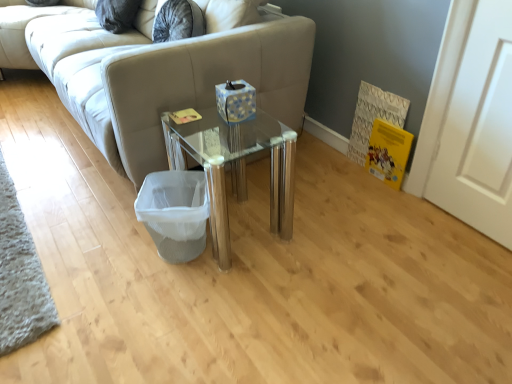
This screenshot has width=512, height=384. Describe the element at coordinates (175, 213) in the screenshot. I see `white mesh laundry basket at lower center` at that location.

Describe the element at coordinates (234, 167) in the screenshot. Image resolution: width=512 pixels, height=384 pixels. I see `transparent glass table at center` at that location.

At what (x,y) coordinates should I click in order to perform the action: click on beige fabric studio couch at center. Please return your answer as a coordinate pair (x, y). This screenshot has width=512, height=384. Looking at the image, I should click on coord(157,69).

This screenshot has height=384, width=512. Identify the location of white mesh laundry basket at lower center. (175, 213).

Consider the image. From the image's perspective, is beige fabric studio couch at center located above or below white mesh laundry basket at lower center?

Clearly, from the image's perspective, beige fabric studio couch at center is above white mesh laundry basket at lower center.

The image size is (512, 384). Find the location of `laundry basket below the beige fabric studio couch at center (from the image's perspective)`. laundry basket below the beige fabric studio couch at center (from the image's perspective) is located at coordinates 175,213.

Does point (77, 13) come farther from viewer compared to point (154, 209)?

Yes.

Who is taller, beige fabric studio couch at center or white mesh laundry basket at lower center?

beige fabric studio couch at center is taller.

Considering the relative sizes of white mesh laundry basket at lower center and beige fabric studio couch at center in the image provided, is white mesh laundry basket at lower center bigger than beige fabric studio couch at center?

Actually, white mesh laundry basket at lower center might be smaller than beige fabric studio couch at center.

This screenshot has width=512, height=384. Identify the location of laundry basket that is under the beige fabric studio couch at center (from a real-world perspective). (175, 213).

Considering the sizes of white mesh laundry basket at lower center and beige fabric studio couch at center in the image, is white mesh laundry basket at lower center wider or thinner than beige fabric studio couch at center?

Clearly, white mesh laundry basket at lower center has less width compared to beige fabric studio couch at center.

From a real-world perspective, is white mesh laundry basket at lower center above or below beige fabric studio couch at center?

white mesh laundry basket at lower center is below beige fabric studio couch at center.

From a real-world perspective, relative to transparent glass table at center, is beige fabric studio couch at center vertically above or below?

beige fabric studio couch at center is situated higher than transparent glass table at center in the real world.

Does point (280, 17) lie in front of point (223, 210)?

No.

Considering the sizes of objects beige fabric studio couch at center and transparent glass table at center in the image provided, who is smaller, beige fabric studio couch at center or transparent glass table at center?

transparent glass table at center.

From the picture: Are beige fabric studio couch at center and transparent glass table at center far apart?

beige fabric studio couch at center is actually quite close to transparent glass table at center.

In the scene shown: From the image's perspective, is transparent glass table at center located beneath white mesh laundry basket at lower center?

No, from the image's perspective, transparent glass table at center is not beneath white mesh laundry basket at lower center.

Is transparent glass table at center placed right next to white mesh laundry basket at lower center?

There is a gap between transparent glass table at center and white mesh laundry basket at lower center.

From a real-world perspective, between transparent glass table at center and white mesh laundry basket at lower center, who is vertically higher?

transparent glass table at center is physically above.

Can you confirm if transparent glass table at center is positioned to the right of white mesh laundry basket at lower center?

Yes.

Is white mesh laundry basket at lower center surrounding transparent glass table at center?

No, white mesh laundry basket at lower center does not contain transparent glass table at center.

From the image's perspective, which one is positioned higher, white mesh laundry basket at lower center or transparent glass table at center?

transparent glass table at center appears higher in the image.

Locate an element on the screen. laundry basket to the left of transparent glass table at center is located at coordinates (175, 213).

Between white mesh laundry basket at lower center and transparent glass table at center, which one has larger size?

Bigger between the two is transparent glass table at center.

Is transparent glass table at center positioned before beige fabric studio couch at center?

That is True.

From the image's perspective, is transparent glass table at center on beige fabric studio couch at center?

Actually, transparent glass table at center appears below beige fabric studio couch at center in the image.

Considering the sizes of objects transparent glass table at center and beige fabric studio couch at center in the image provided, who is smaller, transparent glass table at center or beige fabric studio couch at center?

transparent glass table at center is smaller.

Looking at this image, measure the distance from transparent glass table at center to beige fabric studio couch at center.

They are 19.49 inches apart.

Identify the location of laundry basket to the right of beige fabric studio couch at center. (175, 213).

At what (x,y) coordinates should I click in order to perform the action: click on studio couch above the white mesh laundry basket at lower center (from a real-world perspective). Please return your answer as a coordinate pair (x, y). This screenshot has height=384, width=512. Looking at the image, I should click on (157, 69).

Which object lies nearer to the anchor point beige fabric studio couch at center, white mesh laundry basket at lower center or transparent glass table at center?

transparent glass table at center lies closer to beige fabric studio couch at center than the other object.

Considering their positions, is beige fabric studio couch at center positioned closer to transparent glass table at center than white mesh laundry basket at lower center?

The object closer to transparent glass table at center is white mesh laundry basket at lower center.

Looking at this image, based on their spatial positions, is beige fabric studio couch at center or transparent glass table at center closer to white mesh laundry basket at lower center?

transparent glass table at center.

Considering their positions, is white mesh laundry basket at lower center positioned further to transparent glass table at center than beige fabric studio couch at center?

beige fabric studio couch at center.

Considering their positions, is transparent glass table at center positioned further to white mesh laundry basket at lower center than beige fabric studio couch at center?

Based on the image, beige fabric studio couch at center appears to be further to white mesh laundry basket at lower center.

Looking at the image, which one is located closer to beige fabric studio couch at center, transparent glass table at center or white mesh laundry basket at lower center?

transparent glass table at center is closer to beige fabric studio couch at center.

The image size is (512, 384). In order to click on table between beige fabric studio couch at center and white mesh laundry basket at lower center vertically in this screenshot , I will do `click(234, 167)`.